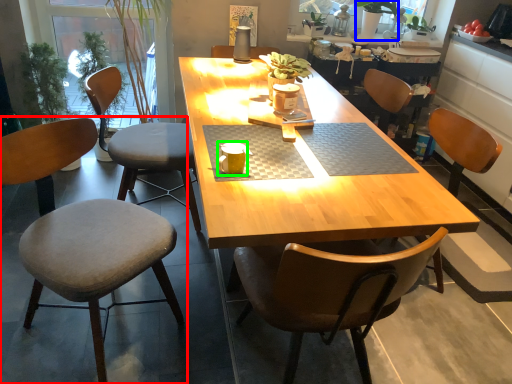
Question: Which is farther away from chair (highlighted by a red box)? houseplant (highlighted by a blue box) or coffee cup (highlighted by a green box)?

Choices:
 (A) houseplant
 (B) coffee cup

Answer: (A)